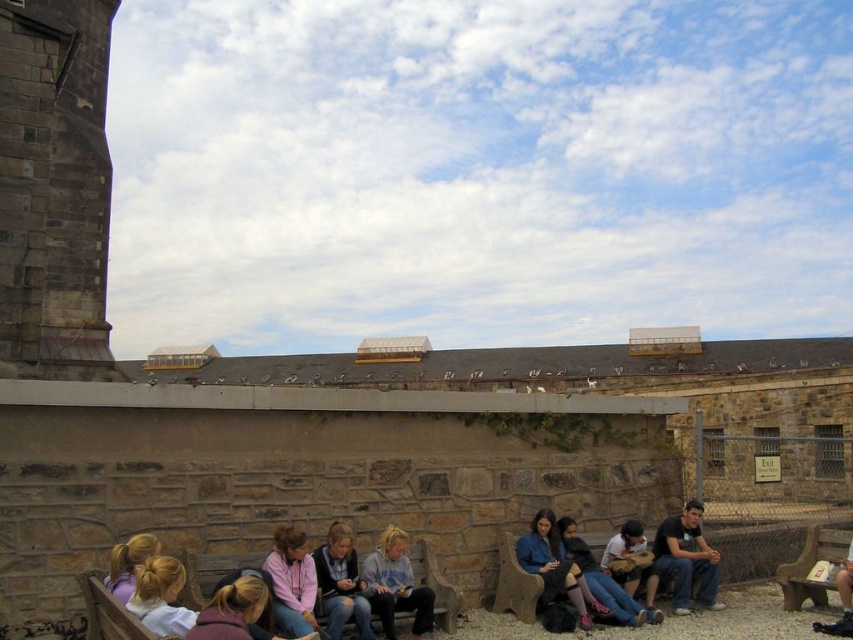
Is point (625, 529) in front of point (332, 621)?

That is False.

Between denim jeans at lower center and denim jacket at center, which one appears on the left side from the viewer's perspective?

denim jacket at center is more to the left.

Is point (627, 586) closer to camera compared to point (334, 628)?

No, it is not.

The width and height of the screenshot is (853, 640). I want to click on denim jeans at lower center, so click(x=614, y=573).

Does point (407, 586) lie in front of point (782, 564)?

Yes.

You are a GUI agent. You are given a task and a screenshot of the screen. Output one action in this format:
    pyautogui.click(x=<x>, y=<y>)
    Task: Click on the matte gray hoodie at center
    
    Given the screenshot: What is the action you would take?
    pyautogui.click(x=395, y=586)

Does denim jacket at lower right have a larger size compared to purple fabric hair at lower left?

Yes.

Looking at this image, can you confirm if denim jacket at lower right is taller than purple fabric hair at lower left?

Correct, denim jacket at lower right is much taller as purple fabric hair at lower left.

The image size is (853, 640). I want to click on denim jacket at lower right, so click(555, 566).